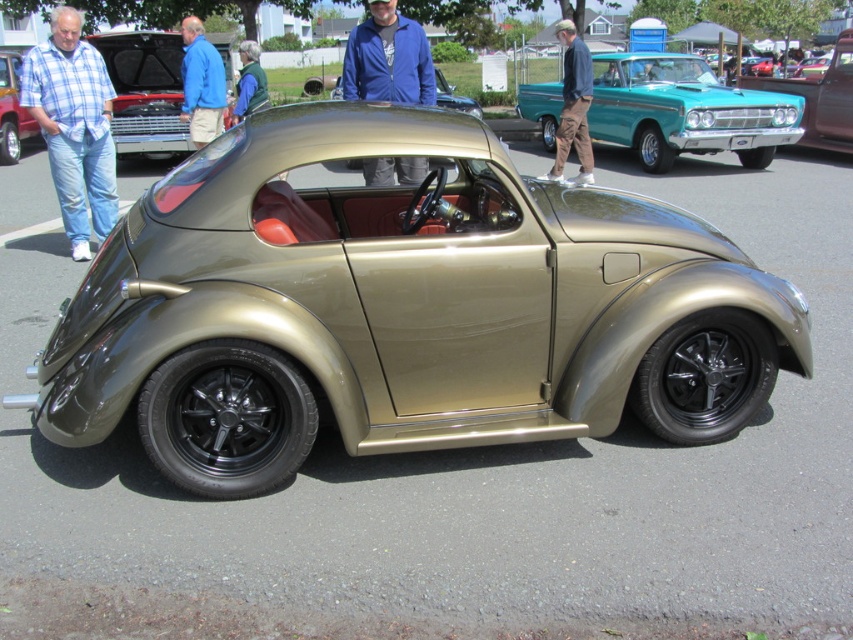
Consider the image. Is teal metallic car at center wider than brown cotton pants at upper center?

Indeed, teal metallic car at center has a greater width compared to brown cotton pants at upper center.

Does teal metallic car at center appear over brown cotton pants at upper center?

Correct, teal metallic car at center is located above brown cotton pants at upper center.

The height and width of the screenshot is (640, 853). Describe the element at coordinates (820, 99) in the screenshot. I see `teal metallic car at center` at that location.

Where is `teal metallic car at center`? The width and height of the screenshot is (853, 640). teal metallic car at center is located at coordinates (820, 99).

Does gold metallic car at upper left have a lesser height compared to brown cotton pants at upper center?

Yes, gold metallic car at upper left is shorter than brown cotton pants at upper center.

Is gold metallic car at upper left to the right of brown cotton pants at upper center from the viewer's perspective?

In fact, gold metallic car at upper left is to the left of brown cotton pants at upper center.

Who is more distant from viewer, (x=119, y=134) or (x=579, y=90)?

Point (x=119, y=134)

The height and width of the screenshot is (640, 853). What are the coordinates of `gold metallic car at upper left` in the screenshot? It's located at tap(144, 90).

Between teal glossy pickup truck at upper center and blue fleece jacket at center, which one is positioned lower?

Positioned lower is blue fleece jacket at center.

Is teal glossy pickup truck at upper center further to the viewer compared to blue fleece jacket at center?

Yes, teal glossy pickup truck at upper center is behind blue fleece jacket at center.

Does point (682, 120) come closer to viewer compared to point (415, 80)?

No.

Identify the location of teal glossy pickup truck at upper center. This screenshot has height=640, width=853. (685, 109).